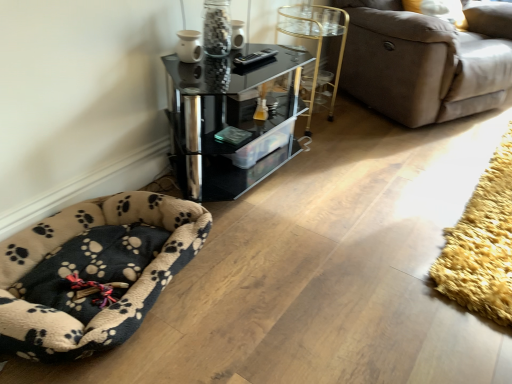
What do you see at coordinates (230, 121) in the screenshot? I see `black glass table at upper center` at bounding box center [230, 121].

This screenshot has height=384, width=512. What do you see at coordinates (482, 244) in the screenshot?
I see `yellow shaggy rug at lower right` at bounding box center [482, 244].

In order to click on beige fleece dog bed at lower left in this screenshot , I will do `click(93, 272)`.

The width and height of the screenshot is (512, 384). Identify the location of transparent glass jar at upper center. (216, 28).

Based on their sizes in the image, would you say yellow shaggy rug at lower right is bigger or smaller than black glass table at upper center?

Considering their sizes, yellow shaggy rug at lower right takes up less space than black glass table at upper center.

Does yellow shaggy rug at lower right have a greater width compared to black glass table at upper center?

In fact, yellow shaggy rug at lower right might be narrower than black glass table at upper center.

Looking at this image, considering the positions of objects yellow shaggy rug at lower right and black glass table at upper center in the image provided, who is more to the right, yellow shaggy rug at lower right or black glass table at upper center?

From the viewer's perspective, yellow shaggy rug at lower right appears more on the right side.

From a real-world perspective, is yellow shaggy rug at lower right located beneath black glass table at upper center?

Correct, in the physical world, yellow shaggy rug at lower right is lower than black glass table at upper center.

Is point (212, 15) positioned in front of point (332, 30)?

Yes, it is in front of point (332, 30).

From the picture: From the image's perspective, is transparent glass jar at upper center on top of gold metallic side table at upper center?

Actually, transparent glass jar at upper center appears below gold metallic side table at upper center in the image.

Is transparent glass jar at upper center not near gold metallic side table at upper center?

No, transparent glass jar at upper center is in close proximity to gold metallic side table at upper center.

Who is bigger, yellow shaggy rug at lower right or transparent glass jar at upper center?

Bigger between the two is yellow shaggy rug at lower right.

Is yellow shaggy rug at lower right taller than transparent glass jar at upper center?

In fact, yellow shaggy rug at lower right may be shorter than transparent glass jar at upper center.

From the image's perspective, is yellow shaggy rug at lower right on transparent glass jar at upper center?

No.

The image size is (512, 384). In order to click on glass vase that is above the yellow shaggy rug at lower right (from the image's perspective) in this screenshot , I will do `click(216, 28)`.

Choose the correct answer: Is beige fleece dog bed at lower left inside transparent glass jar at upper center or outside it?

beige fleece dog bed at lower left is outside transparent glass jar at upper center.

From a real-world perspective, who is located higher, beige fleece dog bed at lower left or transparent glass jar at upper center?

In real-world perspective, transparent glass jar at upper center is above.

Is beige fleece dog bed at lower left taller or shorter than transparent glass jar at upper center?

Considering their sizes, beige fleece dog bed at lower left has less height than transparent glass jar at upper center.

Is beige fleece dog bed at lower left aimed at black glass table at upper center?

No, beige fleece dog bed at lower left is not aimed at black glass table at upper center.

From a real-world perspective, who is located higher, beige fleece dog bed at lower left or black glass table at upper center?

From a 3D spatial view, black glass table at upper center is above.

From a real-world perspective, is brown fabric couch at upper right physically below black glass table at upper center?

Incorrect, from a real-world perspective, brown fabric couch at upper right is higher than black glass table at upper center.

Based on the photo, is brown fabric couch at upper right not inside black glass table at upper center?

Yes.

Considering the relative sizes of brown fabric couch at upper right and black glass table at upper center in the image provided, is brown fabric couch at upper right smaller than black glass table at upper center?

No, brown fabric couch at upper right is not smaller than black glass table at upper center.

Is brown fabric couch at upper right facing away from beige fleece dog bed at lower left?

No, brown fabric couch at upper right's orientation is not away from beige fleece dog bed at lower left.

Does brown fabric couch at upper right have a lesser height compared to beige fleece dog bed at lower left?

No, brown fabric couch at upper right is not shorter than beige fleece dog bed at lower left.

Would you say brown fabric couch at upper right is inside or outside beige fleece dog bed at lower left?

The correct answer is: outside.

In order to click on mat below the black glass table at upper center (from the image's perspective) in this screenshot , I will do `click(482, 244)`.

You are a GUI agent. You are given a task and a screenshot of the screen. Output one action in this format:
    pyautogui.click(x=<x>, y=<y>)
    Task: Click on the glass vase on the left of gold metallic side table at upper center
    Image resolution: width=512 pixels, height=384 pixels.
    Given the screenshot: What is the action you would take?
    pyautogui.click(x=216, y=28)

In the scene shown: Which object lies further to the anchor point gold metallic side table at upper center, beige fleece dog bed at lower left or brown fabric couch at upper right?

Among the two, beige fleece dog bed at lower left is located further to gold metallic side table at upper center.

From the image, which object appears to be nearer to brown fabric couch at upper right, yellow shaggy rug at lower right or beige fleece dog bed at lower left?

The object closer to brown fabric couch at upper right is yellow shaggy rug at lower right.

Which object lies nearer to the anchor point beige fleece dog bed at lower left, yellow shaggy rug at lower right or transparent glass jar at upper center?

The object closer to beige fleece dog bed at lower left is transparent glass jar at upper center.

When comparing their distances from gold metallic side table at upper center, does black glass table at upper center or yellow shaggy rug at lower right seem closer?

black glass table at upper center is positioned closer to the anchor gold metallic side table at upper center.

From the image, which object appears to be farther from brown fabric couch at upper right, gold metallic side table at upper center or beige fleece dog bed at lower left?

beige fleece dog bed at lower left.

When comparing their distances from beige fleece dog bed at lower left, does yellow shaggy rug at lower right or black glass table at upper center seem closer?

black glass table at upper center.

Estimate the real-world distances between objects in this image. Which object is closer to transparent glass jar at upper center, brown fabric couch at upper right or black glass table at upper center?

Among the two, black glass table at upper center is located nearer to transparent glass jar at upper center.

From the image, which object appears to be nearer to brown fabric couch at upper right, black glass table at upper center or beige fleece dog bed at lower left?

black glass table at upper center is positioned closer to the anchor brown fabric couch at upper right.

Where is `studio couch between transparent glass jar at upper center and yellow shaggy rug at lower right in the horizontal direction`? The width and height of the screenshot is (512, 384). studio couch between transparent glass jar at upper center and yellow shaggy rug at lower right in the horizontal direction is located at coordinates (426, 61).

In order to click on table between beige fleece dog bed at lower left and gold metallic side table at upper center in the front-back direction in this screenshot , I will do `click(230, 121)`.

You are a GUI agent. You are given a task and a screenshot of the screen. Output one action in this format:
    pyautogui.click(x=<x>, y=<y>)
    Task: Click on the glass vase between beige fleece dog bed at lower left and brown fabric couch at upper right
    The height and width of the screenshot is (384, 512).
    Given the screenshot: What is the action you would take?
    pyautogui.click(x=216, y=28)

Locate an element on the screen. studio couch between beige fleece dog bed at lower left and yellow shaggy rug at lower right in the horizontal direction is located at coordinates (426, 61).